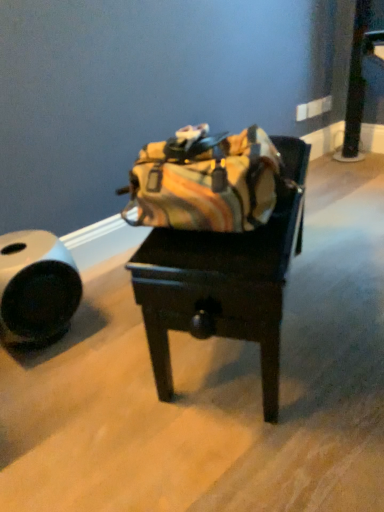
At what (x,y) coordinates should I click in order to perform the action: click on vacant region to the left of leather duffel bag at center. Please return your answer as a coordinate pair (x, y). Looking at the image, I should click on (97, 356).